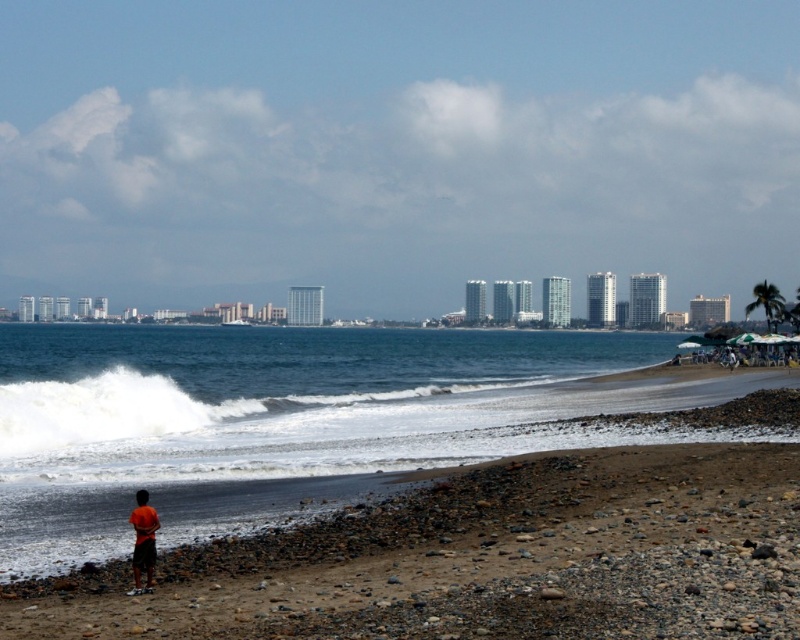
You are standing on the beach and want to walk towards the city skyline in the background. There are two points marked on the ground in front of you. One is at point coordinates point (448, 358) and the other is at point coordinates point (136, 544). Which point should you step on first to ensure you are moving towards the city skyline?

You should step on point (136, 544) first because point (448, 358) is behind it, so stepping on the closer point first will keep you moving toward the city skyline.

You are standing on the beach and want to place a 100 foot long boat exactly at the point marked by the coordinates point (292, 348). Will the boat fit entirely within the visible ocean area without any part going beyond the image frame?

The point (292, 348) is 526.84 feet from the viewer. Since the boat is 100 feet long, it will fit entirely within the visible ocean area as the distance from the viewer to the point is greater than the boat length.

You are a lifeguard on duty and notice the blue water at lower left and the orange fabric shorts at lower left in the scene. Based on their positions, which object is closer to the ocean waves?

The blue water at lower left is much taller as orange fabric shorts at lower left, meaning it is closer to the ocean waves since taller objects are typically nearer in such scenes.